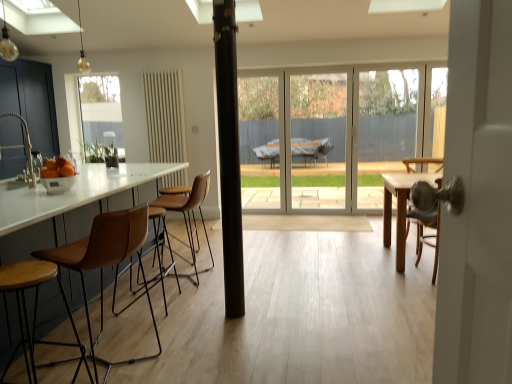
What do you see at coordinates (7, 42) in the screenshot? I see `matte glass bulb at upper left, placed as the 2th light fixture when sorted from right to left` at bounding box center [7, 42].

Find the location of a particular element. matte gold bulb at upper left, positioned as the first light fixture in right-to-left order is located at coordinates point(82,51).

The width and height of the screenshot is (512, 384). What are the coordinates of `matte silver faucet at left` in the screenshot? It's located at (23, 146).

What is the approximate width of transparent glass door at center?

2.65 inches.

Image resolution: width=512 pixels, height=384 pixels. I want to click on orange matte bowl at left, so click(x=57, y=168).

Is transparent glass door at center next to matte silver faucet at left and touching it?

No, transparent glass door at center is not next to matte silver faucet at left.

From the picture: In terms of width, does transparent glass door at center look wider or thinner when compared to matte silver faucet at left?

Clearly, transparent glass door at center has less width compared to matte silver faucet at left.

Considering the positions of objects transparent glass door at center and matte silver faucet at left in the image provided, who is more to the left, transparent glass door at center or matte silver faucet at left?

Positioned to the left is matte silver faucet at left.

From the picture: Can you tell me how much transparent glass door at center and matte glass bulb at upper left, the second light fixture in the back-to-front sequence, differ in facing direction?

The angular difference between transparent glass door at center and matte glass bulb at upper left, the second light fixture in the back-to-front sequence, is 177 degrees.

Is transparent glass door at center wider than matte glass bulb at upper left, placed as the 2th light fixture when sorted from right to left?

No, transparent glass door at center is not wider than matte glass bulb at upper left, placed as the 2th light fixture when sorted from right to left.

From a real-world perspective, which object stands above the other?

matte glass bulb at upper left, which ranks as the 1th light fixture in left-to-right order.

Is transparent glass door at center outside of matte glass bulb at upper left, positioned as the 1th light fixture in front-to-back order?

Indeed, transparent glass door at center is completely outside matte glass bulb at upper left, positioned as the 1th light fixture in front-to-back order.

From the image's perspective, between matte gold bulb at upper left, positioned as the first light fixture in right-to-left order, and orange matte bowl at left, who is located below?

orange matte bowl at left appears lower in the image.

Is orange matte bowl at left at the back of matte gold bulb at upper left, positioned as the first light fixture in right-to-left order?

No, matte gold bulb at upper left, positioned as the first light fixture in right-to-left order, is not facing the opposite direction of orange matte bowl at left.

Between matte gold bulb at upper left, acting as the second light fixture starting from the front, and orange matte bowl at left, which one has larger size?

matte gold bulb at upper left, acting as the second light fixture starting from the front.

From a real-world perspective, between matte gold bulb at upper left, the 1th light fixture when ordered from back to front, and orange matte bowl at left, who is vertically higher?

matte gold bulb at upper left, the 1th light fixture when ordered from back to front, from a real-world perspective.

From the image's perspective, does matte gold bulb at upper left, the second light fixture when ordered from left to right, appear lower than matte black cabinets at left?

No.

Consider the image. Are matte gold bulb at upper left, positioned as the first light fixture in right-to-left order, and matte black cabinets at left far apart?

Yes, matte gold bulb at upper left, positioned as the first light fixture in right-to-left order, and matte black cabinets at left are quite far apart.

Considering the relative sizes of matte gold bulb at upper left, positioned as the first light fixture in right-to-left order, and matte black cabinets at left in the image provided, is matte gold bulb at upper left, positioned as the first light fixture in right-to-left order, bigger than matte black cabinets at left?

No.

Is matte gold bulb at upper left, the second light fixture when ordered from left to right, aimed at matte black cabinets at left?

No, matte gold bulb at upper left, the second light fixture when ordered from left to right, is not facing towards matte black cabinets at left.

Based on the photo, between orange matte bowl at left and brown leather stool at left, which one appears on the left side from the viewer's perspective?

Positioned to the left is orange matte bowl at left.

Is orange matte bowl at left aimed at brown leather stool at left?

No, orange matte bowl at left is not aimed at brown leather stool at left.

From the picture: Between orange matte bowl at left and brown leather stool at left, which one has smaller width?

orange matte bowl at left.

From the image's perspective, relative to brown leather stool at left, is orange matte bowl at left above or below?

orange matte bowl at left is above brown leather stool at left.

Is transparent glass door at center wider or thinner than matte gold bulb at upper left, positioned as the first light fixture in right-to-left order?

Clearly, transparent glass door at center has less width compared to matte gold bulb at upper left, positioned as the first light fixture in right-to-left order.

Between point (336, 106) and point (88, 69), which one is positioned in front?

Point (336, 106)

Considering the positions of objects transparent glass door at center and matte gold bulb at upper left, the 1th light fixture when ordered from back to front, in the image provided, who is more to the right, transparent glass door at center or matte gold bulb at upper left, the 1th light fixture when ordered from back to front,?

Positioned to the right is transparent glass door at center.

Considering the sizes of transparent glass door at center and matte gold bulb at upper left, positioned as the first light fixture in right-to-left order, in the image, is transparent glass door at center taller or shorter than matte gold bulb at upper left, positioned as the first light fixture in right-to-left order,?

Clearly, transparent glass door at center is taller compared to matte gold bulb at upper left, positioned as the first light fixture in right-to-left order.

Which is farther from the camera, (x=99, y=241) or (x=5, y=57)?

The point (x=5, y=57) is behind.

Is brown leather stool at left looking in the opposite direction of matte glass bulb at upper left, the second light fixture in the back-to-front sequence?

No, brown leather stool at left is not facing away from matte glass bulb at upper left, the second light fixture in the back-to-front sequence.

Can you tell me how much brown leather stool at left and matte glass bulb at upper left, which ranks as the 1th light fixture in left-to-right order, differ in facing direction?

The facing directions of brown leather stool at left and matte glass bulb at upper left, which ranks as the 1th light fixture in left-to-right order, are 81.9 degrees apart.

Measure the distance from brown leather stool at left to matte glass bulb at upper left, the second light fixture in the back-to-front sequence.

brown leather stool at left is 12.76 feet away from matte glass bulb at upper left, the second light fixture in the back-to-front sequence.

What are the coordinates of `screen door on the right of matte silver faucet at left` in the screenshot? It's located at (318, 140).

At what (x,y) coordinates should I click in order to perform the action: click on screen door below the matte glass bulb at upper left, the second light fixture in the back-to-front sequence (from a real-world perspective). Please return your answer as a coordinate pair (x, y). Image resolution: width=512 pixels, height=384 pixels. Looking at the image, I should click on (318, 140).

When comparing their distances from matte black cabinets at left, does transparent glass door at center or matte glass bulb at upper left, placed as the 2th light fixture when sorted from right to left, seem further?

transparent glass door at center lies further to matte black cabinets at left than the other object.

Looking at this image, estimate the real-world distances between objects in this image. Which object is further from matte silver faucet at left, matte black cabinets at left or matte gold bulb at upper left, acting as the second light fixture starting from the front?

matte gold bulb at upper left, acting as the second light fixture starting from the front, is positioned further to the anchor matte silver faucet at left.

From the image, which object appears to be farther from matte silver faucet at left, matte glass bulb at upper left, placed as the 2th light fixture when sorted from right to left, or matte gold bulb at upper left, acting as the second light fixture starting from the front?

matte gold bulb at upper left, acting as the second light fixture starting from the front.

Looking at the image, which one is located closer to matte gold bulb at upper left, the 1th light fixture when ordered from back to front, matte glass bulb at upper left, placed as the 2th light fixture when sorted from right to left, or transparent glass door at center?

matte glass bulb at upper left, placed as the 2th light fixture when sorted from right to left, lies closer to matte gold bulb at upper left, the 1th light fixture when ordered from back to front, than the other object.

In the scene shown: Looking at the image, which one is located further to matte glass bulb at upper left, the second light fixture in the back-to-front sequence, black matte pole at center or matte silver faucet at left?

Among the two, black matte pole at center is located further to matte glass bulb at upper left, the second light fixture in the back-to-front sequence.

Based on their spatial positions, is matte glass bulb at upper left, placed as the 2th light fixture when sorted from right to left, or matte gold bulb at upper left, the second light fixture when ordered from left to right, closer to orange matte bowl at left?

Based on the image, matte glass bulb at upper left, placed as the 2th light fixture when sorted from right to left, appears to be nearer to orange matte bowl at left.

Based on their spatial positions, is matte gold bulb at upper left, the second light fixture when ordered from left to right, or matte black cabinets at left closer to matte silver faucet at left?

Based on the image, matte black cabinets at left appears to be nearer to matte silver faucet at left.

Which object lies nearer to the anchor point brown leather stool at left, transparent glass door at center or matte black cabinets at left?

transparent glass door at center.

In order to click on light fixture located between matte black cabinets at left and matte gold bulb at upper left, acting as the second light fixture starting from the front, in the left-right direction in this screenshot , I will do `click(7, 42)`.

Where is `sink positioned between brown leather stool at left and matte black cabinets at left from near to far`? sink positioned between brown leather stool at left and matte black cabinets at left from near to far is located at coordinates (23, 146).

Identify the location of light fixture between matte silver faucet at left and black matte pole at center from left to right. The width and height of the screenshot is (512, 384). (82, 51).

Image resolution: width=512 pixels, height=384 pixels. What are the coordinates of `fruit between matte gold bulb at upper left, the 1th light fixture when ordered from back to front, and brown leather stool at left from top to bottom` in the screenshot? It's located at (57, 168).